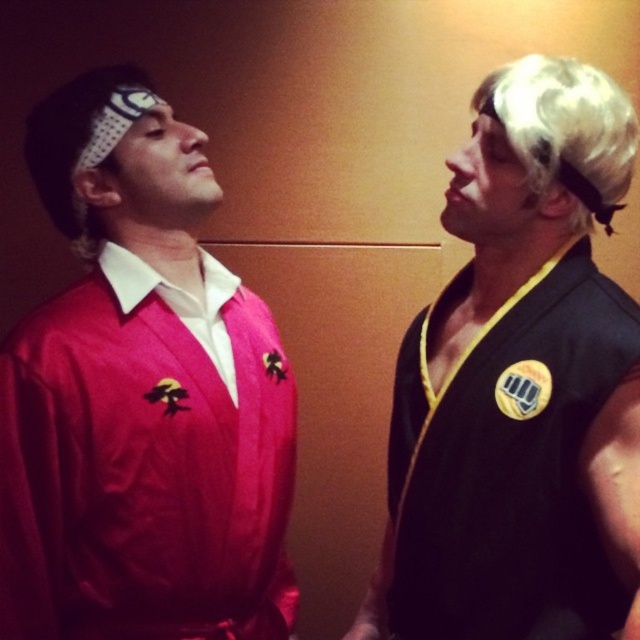
Question: Estimate the real-world distances between objects in this image. Which object is closer to the black matte vest at right?

Choices:
 (A) blonde synthetic wig at upper right
 (B) matte pink sweater at left

Answer: (A)

Question: Can you confirm if matte pink sweater at left is smaller than blonde synthetic wig at upper right?

Choices:
 (A) no
 (B) yes

Answer: (A)

Question: Estimate the real-world distances between objects in this image. Which object is farther from the blonde synthetic wig at upper right?

Choices:
 (A) black matte vest at right
 (B) matte pink sweater at left

Answer: (B)

Question: Which object appears closest to the camera in this image?

Choices:
 (A) black matte vest at right
 (B) blonde synthetic wig at upper right

Answer: (A)

Question: Does black matte vest at right lie behind blonde synthetic wig at upper right?

Choices:
 (A) yes
 (B) no

Answer: (B)

Question: Is matte pink sweater at left smaller than blonde synthetic wig at upper right?

Choices:
 (A) no
 (B) yes

Answer: (A)